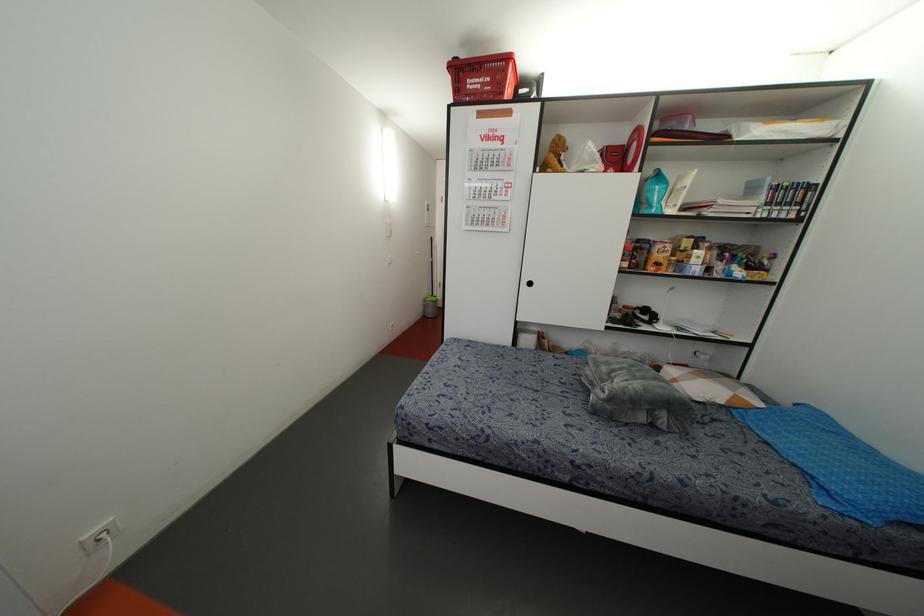
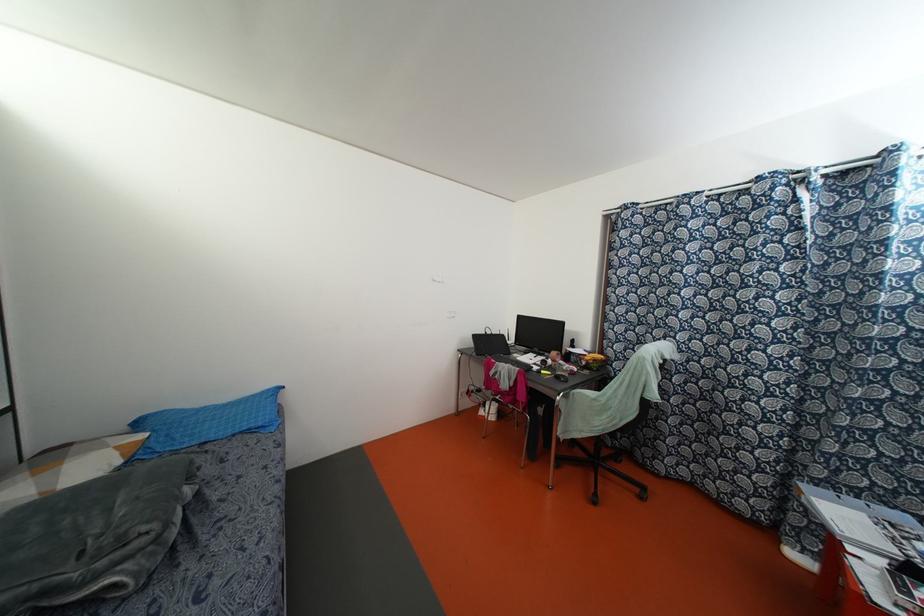
Locate, in the second image, the point that corresponds to point (831, 487) in the first image.

(259, 424)